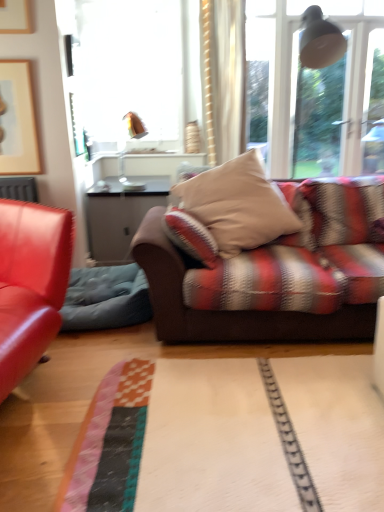
Locate an element on the screen. velvet blue swivel chair at left is located at coordinates (106, 298).

Measure the distance between point (101, 279) and camera.

Point (101, 279) and camera are 2.85 meters apart.

The width and height of the screenshot is (384, 512). What are the coordinates of `copper metallic lamp at upper center` in the screenshot? It's located at (125, 144).

What do you see at coordinates (238, 204) in the screenshot?
I see `beige fabric pillow at center` at bounding box center [238, 204].

Identify the location of beige fabric pillow at center. The height and width of the screenshot is (512, 384). (238, 204).

The width and height of the screenshot is (384, 512). What are the coordinates of `velvet blue swivel chair at left` in the screenshot? It's located at (106, 298).

Who is smaller, copper metallic lamp at upper center or matte wooden picture frame at upper left?

matte wooden picture frame at upper left is smaller.

Is matte wooden picture frame at upper left at the back of copper metallic lamp at upper center?

copper metallic lamp at upper center does not have its back to matte wooden picture frame at upper left.

Is the depth of copper metallic lamp at upper center greater than that of matte wooden picture frame at upper left?

That is True.

What's the angular difference between copper metallic lamp at upper center and matte wooden picture frame at upper left's facing directions?

copper metallic lamp at upper center and matte wooden picture frame at upper left are facing 88.1 degrees away from each other.

Find the location of a particular element. The width and height of the screenshot is (384, 512). pillow below the transparent glass window at upper center (from the image's perspective) is located at coordinates (238, 204).

Is transparent glass window at upper center directly adjacent to beige fabric pillow at center?

No, transparent glass window at upper center is not touching beige fabric pillow at center.

Considering the relative sizes of transparent glass window at upper center and beige fabric pillow at center in the image provided, is transparent glass window at upper center shorter than beige fabric pillow at center?

In fact, transparent glass window at upper center may be taller than beige fabric pillow at center.

Measure the distance from transparent glass window at upper center to beige fabric pillow at center.

They are 2.39 meters apart.

Is transparent glass window at upper center taller than copper metallic lamp at upper center?

Yes, transparent glass window at upper center is taller than copper metallic lamp at upper center.

Considering their positions, is transparent glass window at upper center located in front of or behind copper metallic lamp at upper center?

Clearly, transparent glass window at upper center is in front of copper metallic lamp at upper center.

From the image's perspective, is transparent glass window at upper center positioned above or below copper metallic lamp at upper center?

Based on their image positions, transparent glass window at upper center is located beneath copper metallic lamp at upper center.

How many degrees apart are the facing directions of transparent glass window at upper center and copper metallic lamp at upper center?

88.5 degrees.

Do you think transparent glass window at upper center is within matte wooden picture frame at upper left, or outside of it?

transparent glass window at upper center is located beyond the bounds of matte wooden picture frame at upper left.

Find the location of a particular element. This screenshot has height=512, width=384. window lying in front of the matte wooden picture frame at upper left is located at coordinates (315, 90).

Based on the photo, can you see transparent glass window at upper center touching matte wooden picture frame at upper left?

No, transparent glass window at upper center is not next to matte wooden picture frame at upper left.

Who is shorter, transparent glass window at upper center or matte wooden picture frame at upper left?

matte wooden picture frame at upper left is shorter.

Based on the photo, is copper metallic lamp at upper center smaller than velvet blue swivel chair at left?

Indeed, copper metallic lamp at upper center has a smaller size compared to velvet blue swivel chair at left.

From the image's perspective, which object appears higher, copper metallic lamp at upper center or velvet blue swivel chair at left?

From the image's view, copper metallic lamp at upper center is above.

Is copper metallic lamp at upper center beside velvet blue swivel chair at left?

No.

Which object is positioned more to the left, copper metallic lamp at upper center or velvet blue swivel chair at left?

From the viewer's perspective, velvet blue swivel chair at left appears more on the left side.

From the image's perspective, is matte wooden picture frame at upper left on velvet blue swivel chair at left?

Correct, matte wooden picture frame at upper left appears higher than velvet blue swivel chair at left in the image.

Would you say velvet blue swivel chair at left is part of matte wooden picture frame at upper left's contents?

No.

Is matte wooden picture frame at upper left oriented towards velvet blue swivel chair at left?

No.

How different are the orientations of beige fabric pillow at center and transparent glass window at upper center in degrees?

Result: There is a 3.29-degree angle between the facing directions of beige fabric pillow at center and transparent glass window at upper center.

Is beige fabric pillow at center inside or outside of transparent glass window at upper center?

beige fabric pillow at center is spatially situated outside transparent glass window at upper center.

Is point (213, 208) more distant than point (368, 166)?

No.

Where is `picture frame on the left of copper metallic lamp at upper center`? picture frame on the left of copper metallic lamp at upper center is located at coordinates (17, 120).

This screenshot has height=512, width=384. There is a beige fabric pillow at center. What are the coordinates of `window above it (from a real-world perspective)` in the screenshot? It's located at (315, 90).

When comparing their distances from transparent glass window at upper center, does beige fabric pillow at center or matte wooden picture frame at upper left seem further?

Based on the image, matte wooden picture frame at upper left appears to be further to transparent glass window at upper center.

Estimate the real-world distances between objects in this image. Which object is closer to copper metallic lamp at upper center, beige fabric pillow at center or matte wooden picture frame at upper left?

matte wooden picture frame at upper left is positioned closer to the anchor copper metallic lamp at upper center.

When comparing their distances from transparent glass window at upper center, does velvet blue swivel chair at left or matte wooden picture frame at upper left seem closer?

velvet blue swivel chair at left.

Considering their positions, is velvet blue swivel chair at left positioned further to copper metallic lamp at upper center than transparent glass window at upper center?

transparent glass window at upper center lies further to copper metallic lamp at upper center than the other object.

When comparing their distances from copper metallic lamp at upper center, does transparent glass window at upper center or matte wooden picture frame at upper left seem further?

Among the two, transparent glass window at upper center is located further to copper metallic lamp at upper center.

Looking at the image, which one is located closer to copper metallic lamp at upper center, matte wooden picture frame at upper left or transparent glass window at upper center?

The object closer to copper metallic lamp at upper center is matte wooden picture frame at upper left.

Based on their spatial positions, is beige fabric pillow at center or transparent glass window at upper center further from matte wooden picture frame at upper left?

Among the two, transparent glass window at upper center is located further to matte wooden picture frame at upper left.

Considering their positions, is beige fabric pillow at center positioned further to velvet blue swivel chair at left than copper metallic lamp at upper center?

copper metallic lamp at upper center lies further to velvet blue swivel chair at left than the other object.

Find the location of `pillow between velvet blue swivel chair at left and transparent glass window at upper center in the horizontal direction`. pillow between velvet blue swivel chair at left and transparent glass window at upper center in the horizontal direction is located at coordinates (238, 204).

The image size is (384, 512). I want to click on swivel chair situated between matte wooden picture frame at upper left and transparent glass window at upper center from left to right, so click(x=106, y=298).

Where is `pillow between matte wooden picture frame at upper left and transparent glass window at upper center in the horizontal direction`? pillow between matte wooden picture frame at upper left and transparent glass window at upper center in the horizontal direction is located at coordinates (238, 204).

Identify the location of lamp between matte wooden picture frame at upper left and beige fabric pillow at center in the horizontal direction. The width and height of the screenshot is (384, 512). (125, 144).